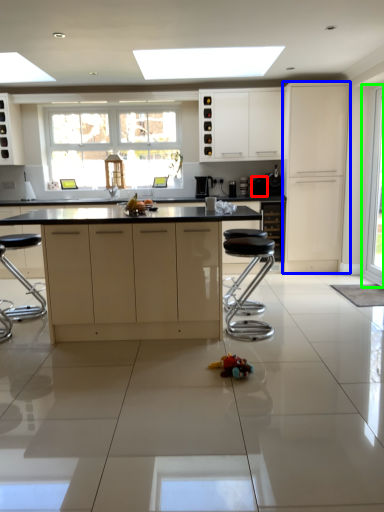
Question: Which object is the farthest from appliance (highlighted by a red box)? Choose among these: cabinetry (highlighted by a blue box) or glass door (highlighted by a green box).

Choices:
 (A) cabinetry
 (B) glass door

Answer: (B)